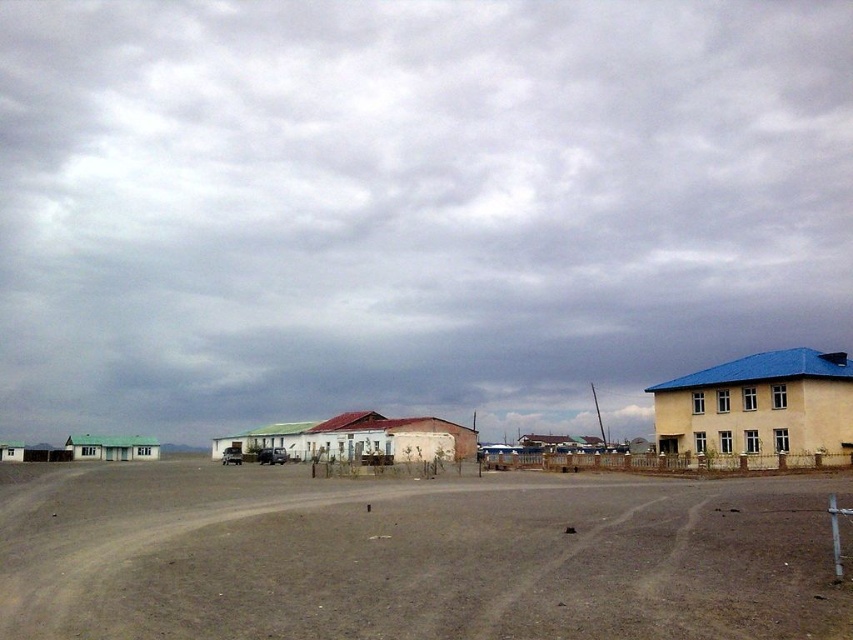
Question: Where is cloudy sky at upper center located in relation to brown dirt field at lower center in the image?

Choices:
 (A) above
 (B) below

Answer: (A)

Question: Can you confirm if cloudy sky at upper center is positioned to the left of brown dirt field at lower center?

Choices:
 (A) no
 (B) yes

Answer: (A)

Question: Which point is closer to the camera?

Choices:
 (A) brown dirt field at lower center
 (B) cloudy sky at upper center

Answer: (A)

Question: Which of the following is the farthest from the observer?

Choices:
 (A) brown dirt field at lower center
 (B) cloudy sky at upper center

Answer: (B)

Question: Can you confirm if cloudy sky at upper center is positioned to the left of brown dirt field at lower center?

Choices:
 (A) no
 (B) yes

Answer: (A)